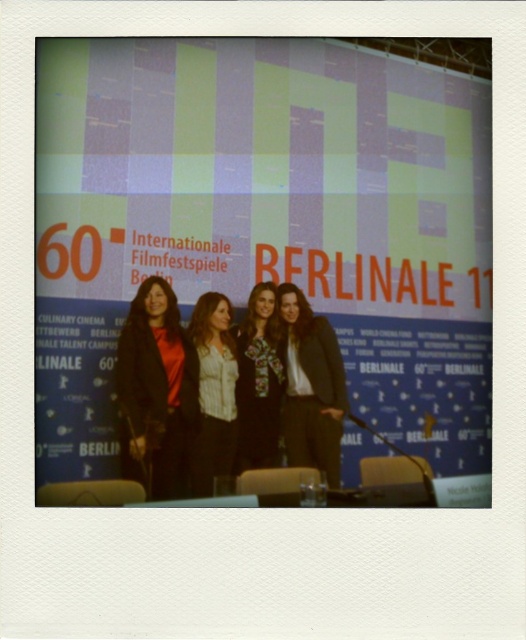
Is matte black coat at left taller than black leather jacket at center?

Yes, matte black coat at left is taller than black leather jacket at center.

Is point (169, 484) positioned in front of point (281, 336)?

Yes, point (169, 484) is closer to viewer.

Describe the element at coordinates (156, 390) in the screenshot. The width and height of the screenshot is (526, 640). I see `matte black coat at left` at that location.

Locate an element on the screen. matte black coat at left is located at coordinates pyautogui.click(x=156, y=390).

Is white textured blouse at center to the right of floral-patterned dress at center from the viewer's perspective?

Incorrect, white textured blouse at center is not on the right side of floral-patterned dress at center.

Is point (219, 449) more distant than point (267, 458)?

No, (219, 449) is closer to viewer.

Locate an element on the screen. The image size is (526, 640). white textured blouse at center is located at coordinates (214, 392).

Between black leather jacket at center and white textured blouse at center, which one has less height?

Standing shorter between the two is black leather jacket at center.

Is black leather jacket at center to the left of white textured blouse at center from the viewer's perspective?

Incorrect, black leather jacket at center is not on the left side of white textured blouse at center.

The height and width of the screenshot is (640, 526). What do you see at coordinates (310, 387) in the screenshot? I see `black leather jacket at center` at bounding box center [310, 387].

Where is `black leather jacket at center`? The height and width of the screenshot is (640, 526). black leather jacket at center is located at coordinates (310, 387).